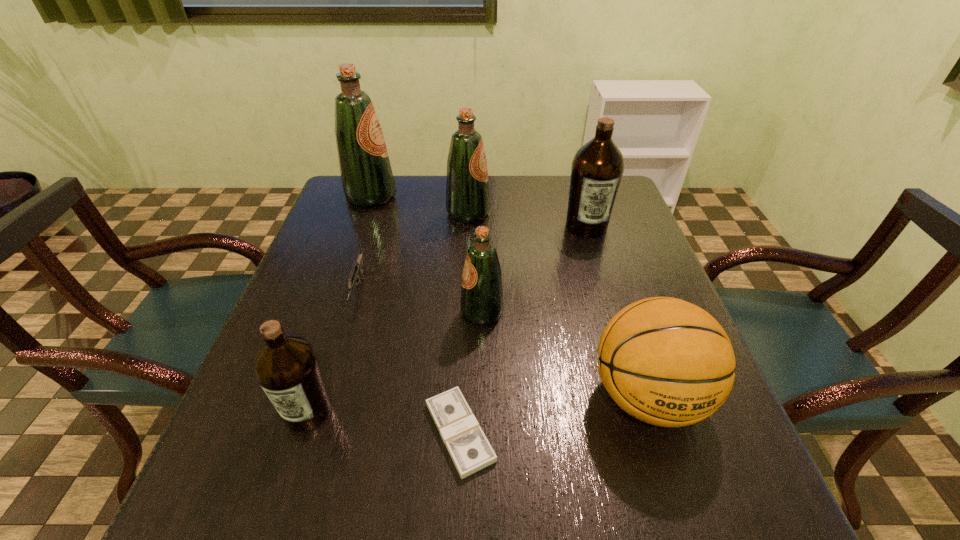
I want to click on vacant space that's between the second smallest green olive oil and the basketball, so click(x=558, y=305).

This screenshot has height=540, width=960. Find the location of `blank region between the rightmost olive oil and the nearest olive oil`. blank region between the rightmost olive oil and the nearest olive oil is located at coordinates (447, 319).

Locate an element on the screen. This screenshot has width=960, height=540. free space between the nearest green olive oil and the shortest object is located at coordinates (470, 373).

Identify which object is located as the fourth nearest to the farther brown olive oil. Please provide its 2D coordinates. Your answer should be formatted as a tuple, i.e. [(x, y)], where the tuple contains the x and y coordinates of a point satisfying the conditions above.

[(366, 175)]

At what (x,y) coordinates should I click in order to perform the action: click on object that stands as the third closest to the basketball. Please return your answer as a coordinate pair (x, y). This screenshot has width=960, height=540. Looking at the image, I should click on (597, 168).

This screenshot has height=540, width=960. I want to click on olive oil object that ranks as the fourth closest to the fourth farthest olive oil, so click(x=366, y=175).

Find the location of `olive oil that is the second closest to the second smallest green olive oil`. olive oil that is the second closest to the second smallest green olive oil is located at coordinates (597, 168).

I want to click on green olive oil that stands as the second closest to the second biggest green olive oil, so click(x=481, y=302).

The image size is (960, 540). I want to click on the second closest green olive oil to the nearest green olive oil, so click(366, 175).

Where is `free point that satisfies the following two spatial constraints: 1. on the front-facing side of the shortest object; 2. on the right side of the leftmost green olive oil`? free point that satisfies the following two spatial constraints: 1. on the front-facing side of the shortest object; 2. on the right side of the leftmost green olive oil is located at coordinates (290, 432).